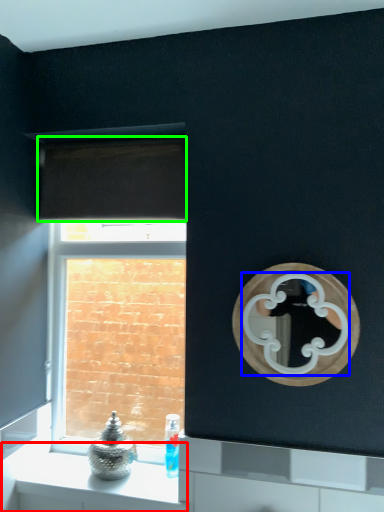
Question: Which object is positioned closest to counter (highlighted by a red box)? Select from mirror (highlighted by a blue box) and curtain (highlighted by a green box).

Choices:
 (A) mirror
 (B) curtain

Answer: (A)